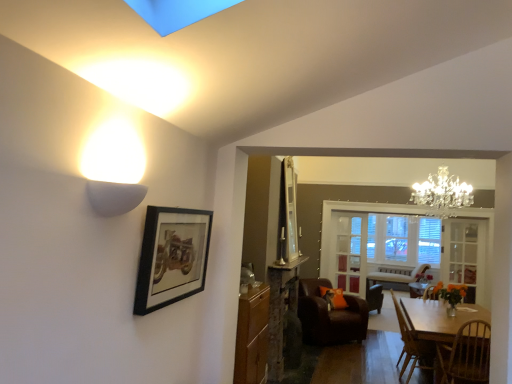
Question: Is the position of clear glass window at center more distant than that of wooden dining table at lower right?

Choices:
 (A) no
 (B) yes

Answer: (B)

Question: Is clear glass window at center aimed at wooden dining table at lower right?

Choices:
 (A) yes
 (B) no

Answer: (A)

Question: Is clear glass window at center placed right next to wooden dining table at lower right?

Choices:
 (A) yes
 (B) no

Answer: (B)

Question: From a real-world perspective, is clear glass window at center located beneath wooden dining table at lower right?

Choices:
 (A) yes
 (B) no

Answer: (B)

Question: Does clear glass window at center have a greater width compared to wooden dining table at lower right?

Choices:
 (A) no
 (B) yes

Answer: (A)

Question: Considering the positions of point (340, 284) and point (456, 317), is point (340, 284) closer or farther from the camera than point (456, 317)?

Choices:
 (A) farther
 (B) closer

Answer: (A)

Question: Considering the positions of clear glass door at center, the second glass door positioned from the right, and wooden dining table at lower right in the image, is clear glass door at center, the second glass door positioned from the right, taller or shorter than wooden dining table at lower right?

Choices:
 (A) short
 (B) tall

Answer: (B)

Question: Looking at their shapes, would you say clear glass door at center, acting as the first glass door starting from the left, is wider or thinner than wooden dining table at lower right?

Choices:
 (A) wide
 (B) thin

Answer: (B)

Question: Considering the relative positions of clear glass door at center, the second glass door positioned from the right, and wooden dining table at lower right in the image provided, is clear glass door at center, the second glass door positioned from the right, to the left or to the right of wooden dining table at lower right?

Choices:
 (A) left
 (B) right

Answer: (A)

Question: Is wooden cabinet at center in front of or behind clear glass door at center, the second glass door positioned from the right, in the image?

Choices:
 (A) behind
 (B) front

Answer: (B)

Question: From the image's perspective, is wooden cabinet at center positioned above or below clear glass door at center, the second glass door positioned from the right?

Choices:
 (A) above
 (B) below

Answer: (B)

Question: Is wooden cabinet at center wider or thinner than clear glass door at center, acting as the first glass door starting from the left?

Choices:
 (A) thin
 (B) wide

Answer: (B)

Question: Is wooden cabinet at center inside or outside of clear glass door at center, which is the 1th glass door from back to front?

Choices:
 (A) inside
 (B) outside

Answer: (B)

Question: Considering the positions of clear glass door at center, the second glass door positioned from the right, and wooden chair at lower right, which ranks as the 2th chair in front-to-back order, in the image, is clear glass door at center, the second glass door positioned from the right, taller or shorter than wooden chair at lower right, which ranks as the 2th chair in front-to-back order,?

Choices:
 (A) short
 (B) tall

Answer: (B)

Question: Is clear glass door at center, marked as the second glass door in a front-to-back arrangement, inside the boundaries of wooden chair at lower right, which ranks as the 2th chair in front-to-back order, or outside?

Choices:
 (A) outside
 (B) inside

Answer: (A)